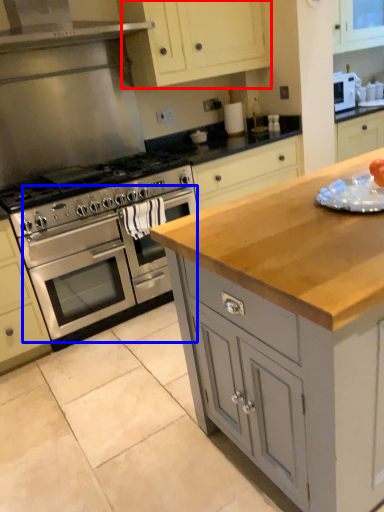
Question: Which of the following is the closest to the observer, cabinetry (highlighted by a red box) or oven (highlighted by a blue box)?

Choices:
 (A) cabinetry
 (B) oven

Answer: (B)